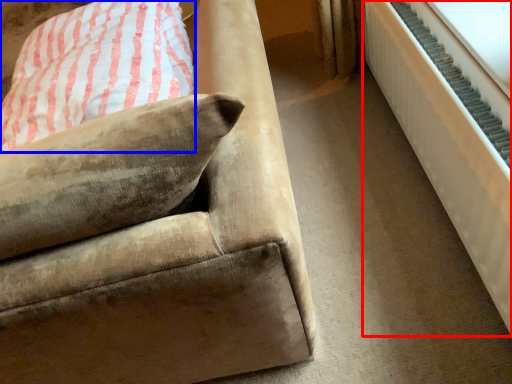
Question: Which of the following is the farthest to the observer, radiator (highlighted by a red box) or pillow (highlighted by a blue box)?

Choices:
 (A) radiator
 (B) pillow

Answer: (B)